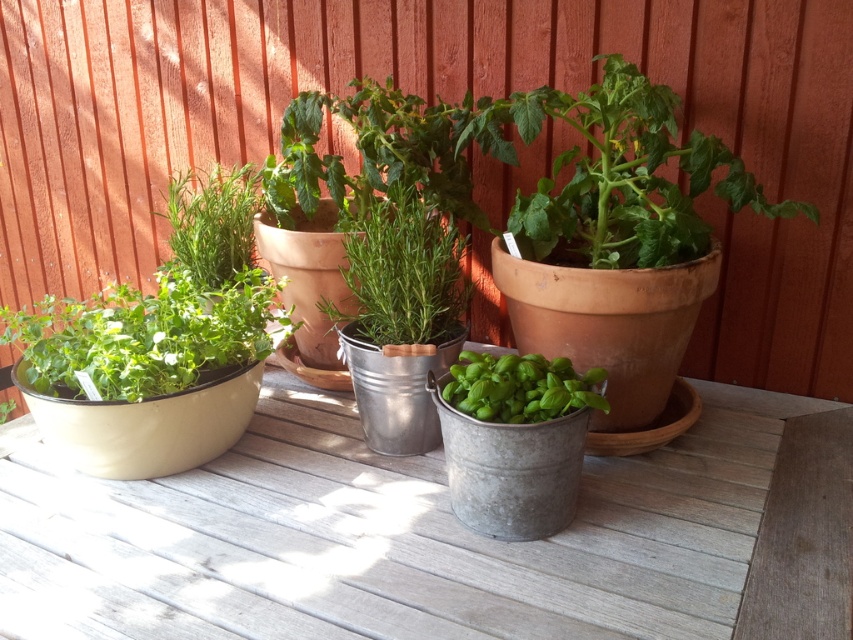
Question: Does green matte herb at upper left have a lesser width compared to green matte basil at center?

Choices:
 (A) no
 (B) yes

Answer: (A)

Question: Can you confirm if green matte herb at upper left is thinner than green matte basil at center?

Choices:
 (A) yes
 (B) no

Answer: (B)

Question: Which object is the closest to the green matte herb at upper left?

Choices:
 (A) green matte herb at center
 (B) green matte herb at left
 (C) green matte basil at center

Answer: (B)

Question: Is green matte herb at center bigger than green matte herb at upper left?

Choices:
 (A) no
 (B) yes

Answer: (A)

Question: Which point appears closest to the camera in this image?

Choices:
 (A) (403, 332)
 (B) (125, 362)

Answer: (B)

Question: Which object is positioned closest to the green matte herb at left?

Choices:
 (A) green matte basil at center
 (B) green matte herb at center
 (C) green matte herb at upper left

Answer: (C)